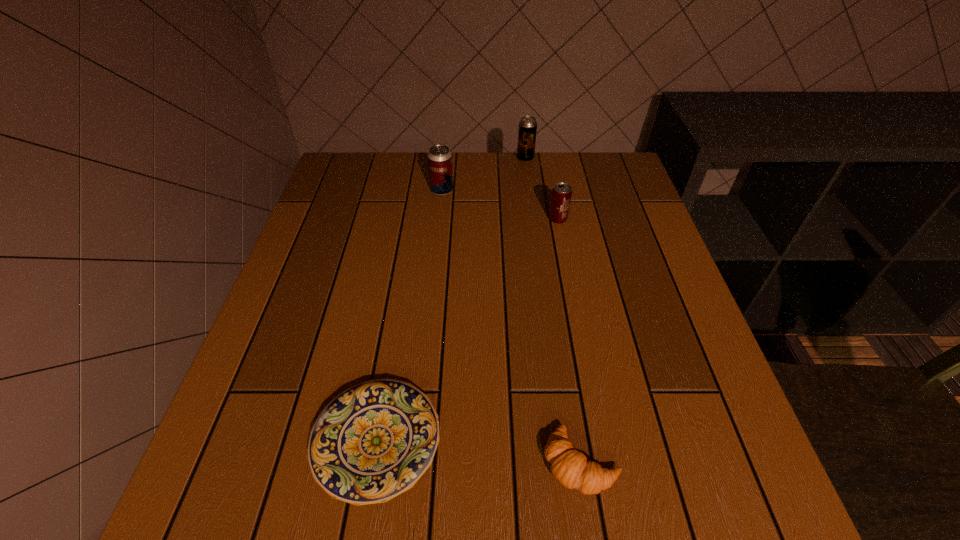
Where is `vacant area that lies between the shortest object and the second farthest beer can`? vacant area that lies between the shortest object and the second farthest beer can is located at coordinates (410, 316).

The image size is (960, 540). What are the coordinates of `vacant space in between the fourth tallest object and the rightmost beer can` in the screenshot? It's located at (569, 340).

At what (x,y) coordinates should I click in order to perform the action: click on blank region between the crescent roll and the second nearest beer can. Please return your answer as a coordinate pair (x, y). This screenshot has height=540, width=960. Looking at the image, I should click on (512, 326).

You are a GUI agent. You are given a task and a screenshot of the screen. Output one action in this format:
    pyautogui.click(x=<x>, y=<y>)
    Task: Click on the empty space between the leftmost beer can and the farthest object
    The width and height of the screenshot is (960, 540).
    Given the screenshot: What is the action you would take?
    pyautogui.click(x=484, y=174)

Identify the location of empty space that is in between the crescent roll and the rightmost beer can. (569, 340).

Locate an element on the screen. object identified as the closest to the plate is located at coordinates pyautogui.click(x=569, y=466).

Identify which object is the second closest to the second shortest object. Please provide its 2D coordinates. Your answer should be formatted as a tuple, i.e. [(x, y)], where the tuple contains the x and y coordinates of a point satisfying the conditions above.

[(561, 195)]

Locate an element on the screen. This screenshot has height=540, width=960. beer can object that ranks as the closest to the fourth tallest object is located at coordinates (561, 195).

Point out which beer can is positioned as the nearest to the leftmost beer can. Please provide its 2D coordinates. Your answer should be formatted as a tuple, i.e. [(x, y)], where the tuple contains the x and y coordinates of a point satisfying the conditions above.

[(527, 130)]